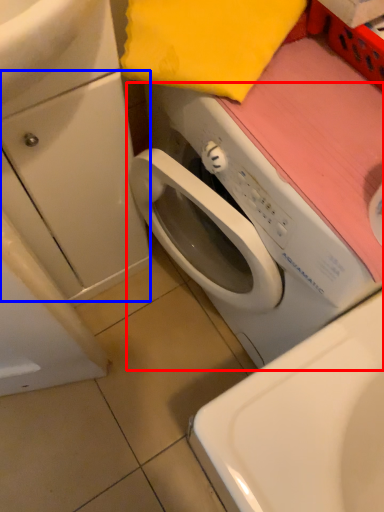
Question: Which point is further to the camera, washing machine (highlighted by a red box) or drawer (highlighted by a blue box)?

Choices:
 (A) washing machine
 (B) drawer

Answer: (B)